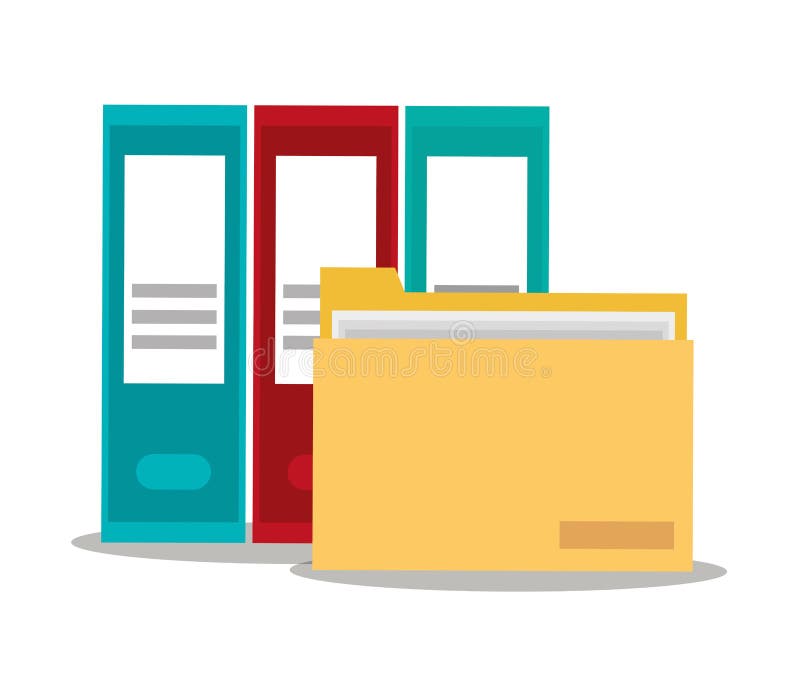
You are a GUI agent. You are given a task and a screenshot of the screen. Output one action in this format:
    pyautogui.click(x=<x>, y=<y>)
    Task: Click on the paper in brown folder
    This screenshot has width=800, height=697.
    Given the screenshot: What is the action you would take?
    pyautogui.click(x=569, y=327)